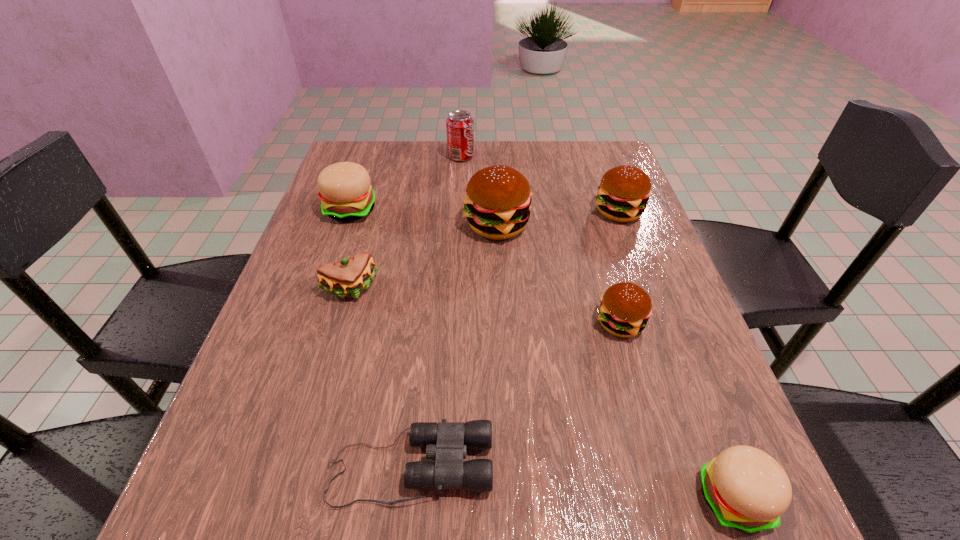
The image size is (960, 540). Find the location of `the right beige hamburger`. the right beige hamburger is located at coordinates (747, 489).

Identify the location of the shortest object. The image size is (960, 540). coord(447,442).

Locate an element on the screen. blank space located 0.120m on the left of the leftmost brown hamburger is located at coordinates (413, 225).

I want to click on blank area located 0.170m on the left of the farthest object, so click(390, 157).

This screenshot has height=540, width=960. What are the coordinates of `vacant space located on the front of the second biggest brown hamburger` in the screenshot? It's located at (647, 289).

This screenshot has height=540, width=960. I want to click on free point located on the back of the bigger beige hamburger, so click(x=373, y=145).

Identify the location of free location located on the front of the sandwich. The width and height of the screenshot is (960, 540). (327, 369).

Locate an element on the screen. The height and width of the screenshot is (540, 960). vacant space located 0.160m on the front of the nearest brown hamburger is located at coordinates (650, 426).

Image resolution: width=960 pixels, height=540 pixels. Find the location of `free location located on the left of the nearer beige hamburger`. free location located on the left of the nearer beige hamburger is located at coordinates (422, 497).

Identify the location of free location located 0.230m at the eyepiece of the binoculars. (647, 466).